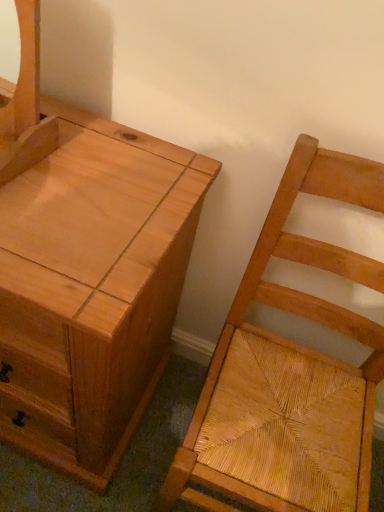
The height and width of the screenshot is (512, 384). Describe the element at coordinates (85, 270) in the screenshot. I see `natural wood chest of drawers at left` at that location.

In order to face natural wood chest of drawers at left, should I rotate leftwards or rightwards?

You should rotate left by 21.210 degrees.

The height and width of the screenshot is (512, 384). Identify the location of natural wood chest of drawers at left. (85, 270).

Measure the distance between natural wood chest of drawers at left and camera.

The distance of natural wood chest of drawers at left from camera is 55.35 centimeters.

You are a GUI agent. You are given a task and a screenshot of the screen. Output one action in this format:
    pyautogui.click(x=<x>, y=<y>)
    Task: Click on the natural wood woven seat at right
    This screenshot has width=384, height=512.
    Given the screenshot: What is the action you would take?
    pyautogui.click(x=290, y=370)

This screenshot has height=512, width=384. Describe the element at coordinates (290, 370) in the screenshot. I see `natural wood woven seat at right` at that location.

Where is `natural wood chest of drawers at left`? natural wood chest of drawers at left is located at coordinates (85, 270).

In the image, is natural wood woven seat at right on the left side or the right side of natural wood chest of drawers at left?

natural wood woven seat at right is positioned on natural wood chest of drawers at left's right side.

Considering the relative positions of natural wood woven seat at right and natural wood chest of drawers at left in the image provided, is natural wood woven seat at right behind natural wood chest of drawers at left?

No, natural wood woven seat at right is closer to the viewer.

Which is behind, point (343, 436) or point (89, 472)?

The point (89, 472) is behind.

From the image's perspective, which is above, natural wood woven seat at right or natural wood chest of drawers at left?

natural wood chest of drawers at left.

From a real-world perspective, does natural wood woven seat at right sit lower than natural wood chest of drawers at left?

No, from a real-world perspective, natural wood woven seat at right is not beneath natural wood chest of drawers at left.

Looking at this image, in terms of width, does natural wood woven seat at right look wider or thinner when compared to natural wood chest of drawers at left?

natural wood woven seat at right is thinner than natural wood chest of drawers at left.

Considering the sizes of objects natural wood woven seat at right and natural wood chest of drawers at left in the image provided, who is shorter, natural wood woven seat at right or natural wood chest of drawers at left?

With less height is natural wood chest of drawers at left.

Considering the sizes of objects natural wood woven seat at right and natural wood chest of drawers at left in the image provided, who is smaller, natural wood woven seat at right or natural wood chest of drawers at left?

Smaller between the two is natural wood woven seat at right.

Looking at this image, is natural wood woven seat at right spatially inside natural wood chest of drawers at left, or outside of it?

natural wood woven seat at right is located beyond the bounds of natural wood chest of drawers at left.

Is natural wood woven seat at right placed right next to natural wood chest of drawers at left?

No, natural wood woven seat at right is not with natural wood chest of drawers at left.

Could you tell me if natural wood woven seat at right is turned towards natural wood chest of drawers at left?

No, natural wood woven seat at right is not turned towards natural wood chest of drawers at left.

Consider the image. What's the angular difference between natural wood woven seat at right and natural wood chest of drawers at left's facing directions?

natural wood woven seat at right and natural wood chest of drawers at left are facing 0.0711 degrees away from each other.

Measure the distance between natural wood woven seat at right and natural wood chest of drawers at left.

A distance of 11.75 inches exists between natural wood woven seat at right and natural wood chest of drawers at left.

Where is `chair in front of the natural wood chest of drawers at left`? chair in front of the natural wood chest of drawers at left is located at coordinates (290, 370).

Would you say natural wood chest of drawers at left is to the left or to the right of natural wood woven seat at right in the picture?

natural wood chest of drawers at left is to the left of natural wood woven seat at right.

Does natural wood chest of drawers at left lie behind natural wood woven seat at right?

Yes.

Between point (149, 296) and point (206, 381), which one is positioned in front?

Point (149, 296)

From the image's perspective, which is below, natural wood chest of drawers at left or natural wood woven seat at right?

natural wood woven seat at right.

From a real-world perspective, between natural wood chest of drawers at left and natural wood woven seat at right, who is vertically lower?

In real-world perspective, natural wood chest of drawers at left is lower.

Can you confirm if natural wood chest of drawers at left is wider than natural wood woven seat at right?

Correct, the width of natural wood chest of drawers at left exceeds that of natural wood woven seat at right.

Between natural wood chest of drawers at left and natural wood woven seat at right, which one has less height?

With less height is natural wood chest of drawers at left.

Does natural wood chest of drawers at left have a larger size compared to natural wood woven seat at right?

Yes, natural wood chest of drawers at left is bigger than natural wood woven seat at right.

Is natural wood woven seat at right completely or partially inside natural wood chest of drawers at left?

No, natural wood woven seat at right is not surrounded by natural wood chest of drawers at left.

Is natural wood chest of drawers at left far away from natural wood woven seat at right?

No, natural wood chest of drawers at left is not far away from natural wood woven seat at right.

Is natural wood chest of drawers at left looking in the opposite direction of natural wood woven seat at right?

No.

How many degrees apart are the facing directions of natural wood chest of drawers at left and natural wood woven seat at right?

The angle between the facing direction of natural wood chest of drawers at left and the facing direction of natural wood woven seat at right is 0.0711 degrees.

Where is `chest of drawers that appears on the left of natural wood woven seat at right`? chest of drawers that appears on the left of natural wood woven seat at right is located at coordinates (85, 270).

Where is `chair that appears below the natural wood chest of drawers at left (from the image's perspective)`? This screenshot has width=384, height=512. chair that appears below the natural wood chest of drawers at left (from the image's perspective) is located at coordinates (290, 370).

You are a GUI agent. You are given a task and a screenshot of the screen. Output one action in this format:
    pyautogui.click(x=<x>, y=<y>)
    Task: Click on the chest of drawers above the natural wood woven seat at right (from the image's perspective)
    The image size is (384, 512).
    Given the screenshot: What is the action you would take?
    click(85, 270)